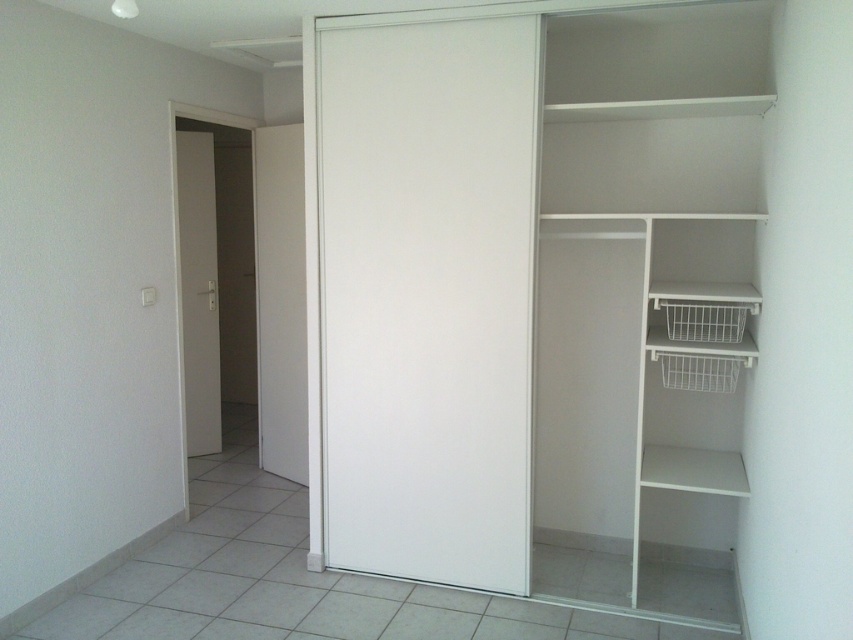
Question: Which of the following is the farthest from the observer?

Choices:
 (A) white matte door at left
 (B) white matte sliding door at center
 (C) white matte closet at center

Answer: (A)

Question: Estimate the real-world distances between objects in this image. Which object is closer to the white matte closet at center?

Choices:
 (A) white smooth door at left
 (B) white matte sliding door at center
 (C) white matte door at left

Answer: (B)

Question: Can you confirm if white matte sliding door at center is positioned to the left of white smooth door at left?

Choices:
 (A) yes
 (B) no

Answer: (B)

Question: Is white matte sliding door at center positioned in front of white matte door at left?

Choices:
 (A) no
 (B) yes

Answer: (B)

Question: In this image, where is white smooth door at left located relative to white matte door at left?

Choices:
 (A) left
 (B) right

Answer: (B)

Question: Based on their relative distances, which object is farther from the white smooth door at left?

Choices:
 (A) white matte door at left
 (B) white matte sliding door at center
 (C) white matte closet at center

Answer: (C)